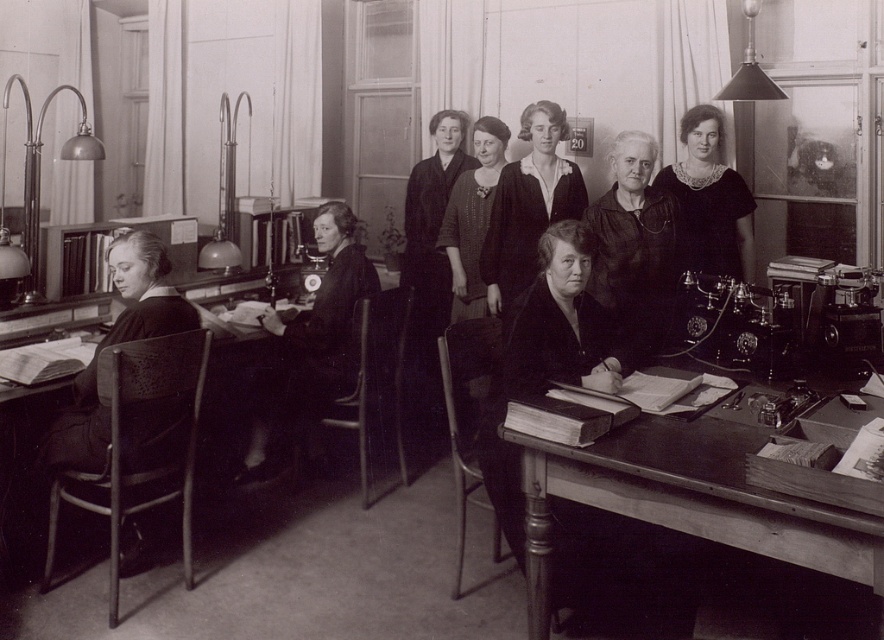
In the office scene, there is a wooden desk at lower right and a woman wearing a matte black dress at center. Which object is wider?

The wooden desk at lower right is wider than the matte black dress at center.